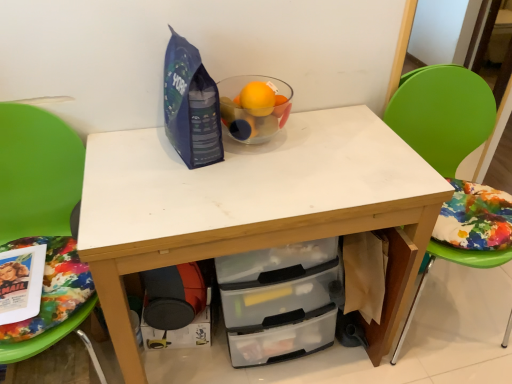
At what (x,y) coordinates should I click in order to perform the action: click on free space in front of transparent glass bowl at center. Please return your answer as a coordinate pair (x, y). Looking at the image, I should click on (259, 177).